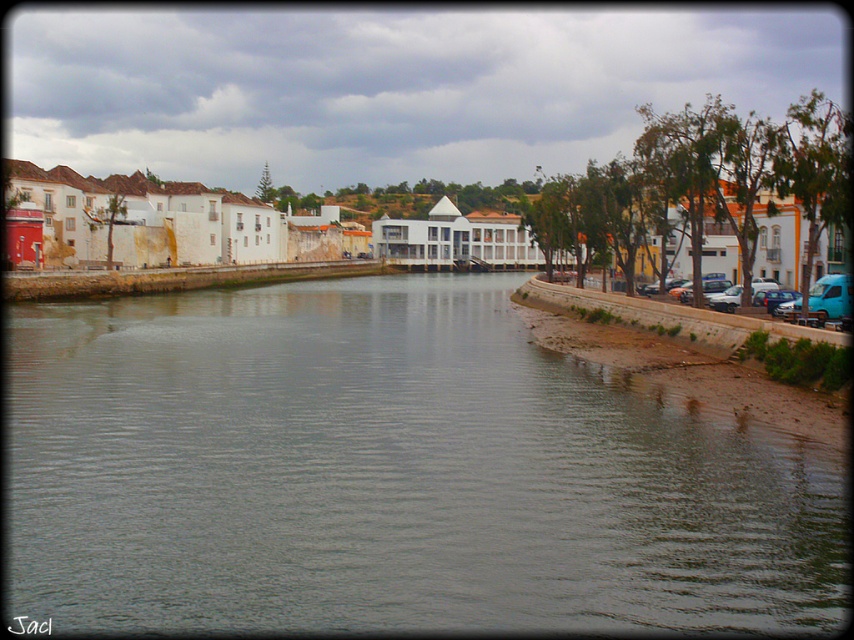
Does green water at center come behind brown stone embankment at right?

No, green water at center is in front of brown stone embankment at right.

Does green water at center lie in front of brown stone embankment at right?

Yes, it is.

Between point (502, 504) and point (803, 403), which one is positioned behind?

Point (803, 403)

The height and width of the screenshot is (640, 854). Identify the location of green water at center. (390, 474).